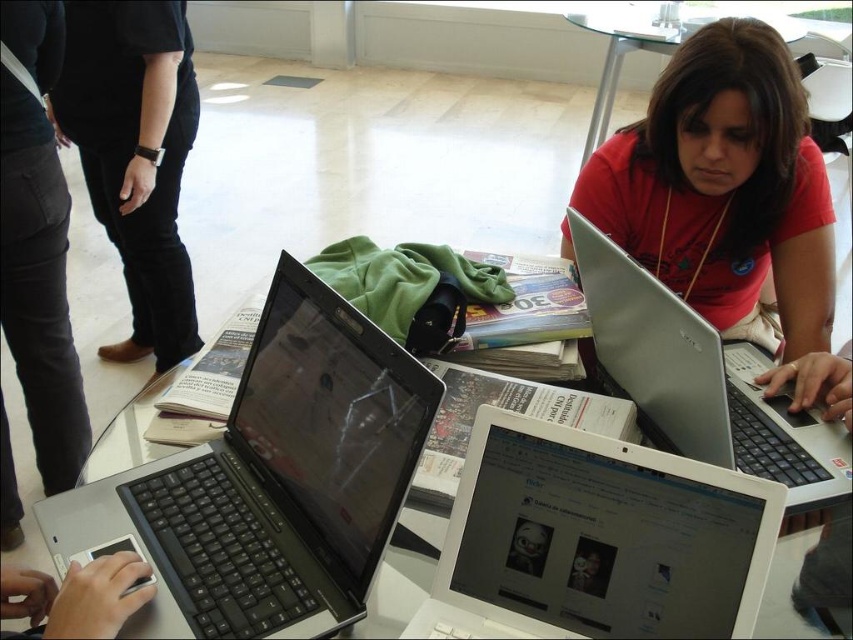
Which of these two, white glossy laptop at center or silver metallic laptop at center, stands shorter?

white glossy laptop at center

Image resolution: width=853 pixels, height=640 pixels. Identify the location of white glossy laptop at center. (596, 540).

The width and height of the screenshot is (853, 640). Identify the location of white glossy laptop at center. (596, 540).

Who is more distant from viewer, (102, 548) or (618, 186)?

Point (618, 186)

Where is `black plastic laptops at center`? black plastic laptops at center is located at coordinates (270, 481).

Can you confirm if black plastic laptops at center is positioned to the left of white glossy laptop at center?

Indeed, black plastic laptops at center is positioned on the left side of white glossy laptop at center.

Measure the distance between point (140,512) and camera.

Point (140,512) and camera are 33.14 inches apart from each other.

I want to click on black plastic laptops at center, so click(x=270, y=481).

Locate an element on the screen. The width and height of the screenshot is (853, 640). black plastic laptops at center is located at coordinates (270, 481).